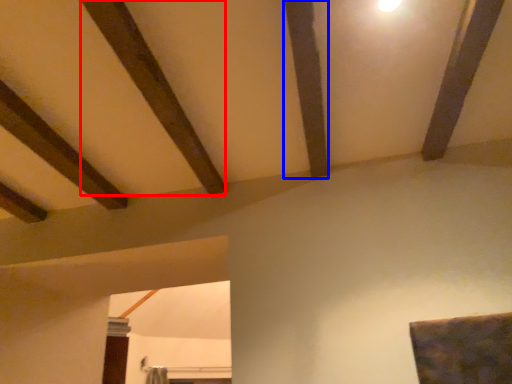
Question: Among these objects, which one is nearest to the camera, plank (highlighted by a red box) or plank (highlighted by a blue box)?

Choices:
 (A) plank
 (B) plank

Answer: (A)